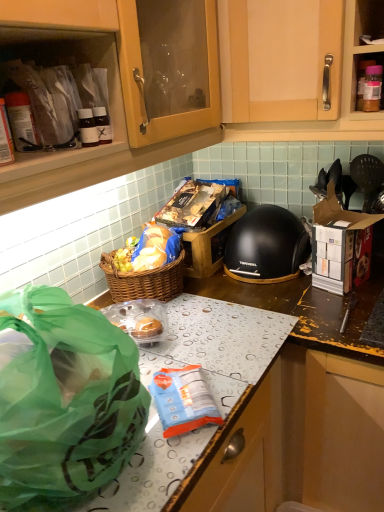
Question: Considering the relative sizes of green translucent bag at lower left and matte plastic containers at upper left in the image provided, is green translucent bag at lower left taller than matte plastic containers at upper left?

Choices:
 (A) yes
 (B) no

Answer: (A)

Question: Are green translucent bag at lower left and matte plastic containers at upper left making contact?

Choices:
 (A) no
 (B) yes

Answer: (A)

Question: From a real-world perspective, is green translucent bag at lower left positioned under matte plastic containers at upper left based on gravity?

Choices:
 (A) no
 (B) yes

Answer: (B)

Question: From a real-world perspective, does green translucent bag at lower left stand above matte plastic containers at upper left?

Choices:
 (A) no
 (B) yes

Answer: (A)

Question: Is there a large distance between green translucent bag at lower left and matte plastic containers at upper left?

Choices:
 (A) yes
 (B) no

Answer: (B)

Question: Is green translucent bag at lower left in front of matte plastic containers at upper left?

Choices:
 (A) yes
 (B) no

Answer: (A)

Question: Is cardboard box at right bigger than green translucent bag at lower left?

Choices:
 (A) no
 (B) yes

Answer: (A)

Question: Is cardboard box at right at the left side of green translucent bag at lower left?

Choices:
 (A) yes
 (B) no

Answer: (B)

Question: Can you confirm if cardboard box at right is wider than green translucent bag at lower left?

Choices:
 (A) no
 (B) yes

Answer: (A)

Question: Is cardboard box at right in front of green translucent bag at lower left?

Choices:
 (A) no
 (B) yes

Answer: (A)

Question: Does cardboard box at right come behind green translucent bag at lower left?

Choices:
 (A) no
 (B) yes

Answer: (B)

Question: Does cardboard box at right have a lesser width compared to green translucent bag at lower left?

Choices:
 (A) no
 (B) yes

Answer: (B)

Question: From a real-world perspective, is black matte helmet at center under blue plastic bag at center?

Choices:
 (A) no
 (B) yes

Answer: (A)